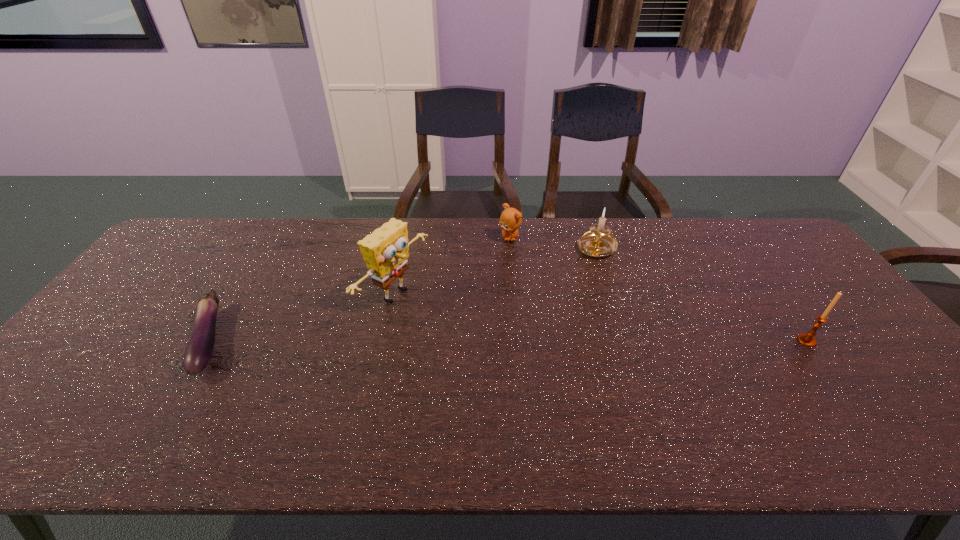
At what (x,y) coordinates should I click in order to perform the action: click on eggplant. Please return your answer as a coordinate pair (x, y). This screenshot has width=960, height=540. Looking at the image, I should click on (198, 352).

Image resolution: width=960 pixels, height=540 pixels. In order to click on the leftmost object in this screenshot , I will do `click(198, 352)`.

Where is `the rightmost object`? the rightmost object is located at coordinates (808, 339).

Identify the location of the nearer candle holder. (808, 339).

Where is `the fourth tallest object`? This screenshot has height=540, width=960. the fourth tallest object is located at coordinates (510, 219).

This screenshot has height=540, width=960. Find the location of `teddy bear`. teddy bear is located at coordinates (510, 219).

What are the coordinates of `sponge` in the screenshot? It's located at (385, 251).

Locate an element on the screen. the tallest object is located at coordinates (385, 251).

In order to click on the fourth object from left to right in this screenshot , I will do `click(598, 242)`.

This screenshot has height=540, width=960. I want to click on the shorter candle holder, so click(598, 242).